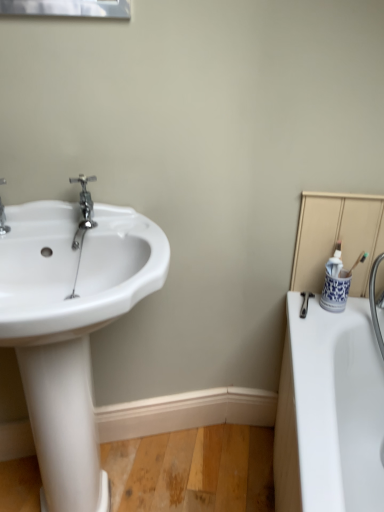
Question: Can blue and white ceramic cup at right be found inside white glossy sink at left?

Choices:
 (A) no
 (B) yes

Answer: (A)

Question: Is white glossy sink at left wider than blue and white ceramic cup at right?

Choices:
 (A) yes
 (B) no

Answer: (A)

Question: Is white glossy sink at left looking in the opposite direction of blue and white ceramic cup at right?

Choices:
 (A) yes
 (B) no

Answer: (B)

Question: From the image's perspective, is white glossy sink at left on top of blue and white ceramic cup at right?

Choices:
 (A) no
 (B) yes

Answer: (A)

Question: Does white glossy sink at left have a lesser width compared to blue and white ceramic cup at right?

Choices:
 (A) no
 (B) yes

Answer: (A)

Question: Considering the relative sizes of white glossy sink at left and blue and white ceramic cup at right in the image provided, is white glossy sink at left taller than blue and white ceramic cup at right?

Choices:
 (A) yes
 (B) no

Answer: (A)

Question: Is polished chrome faucet at left to the left of blue and white ceramic cup at right from the viewer's perspective?

Choices:
 (A) no
 (B) yes

Answer: (B)

Question: From the image's perspective, is polished chrome faucet at left located above blue and white ceramic cup at right?

Choices:
 (A) no
 (B) yes

Answer: (B)

Question: Does polished chrome faucet at left lie in front of blue and white ceramic cup at right?

Choices:
 (A) yes
 (B) no

Answer: (A)

Question: Is blue and white ceramic cup at right surrounded by polished chrome faucet at left?

Choices:
 (A) no
 (B) yes

Answer: (A)

Question: Is blue and white ceramic cup at right at the back of polished chrome faucet at left?

Choices:
 (A) no
 (B) yes

Answer: (A)

Question: Is polished chrome faucet at left facing towards blue and white ceramic cup at right?

Choices:
 (A) no
 (B) yes

Answer: (A)

Question: From the image's perspective, is blue and white ceramic cup at right under white glossy sink at left?

Choices:
 (A) no
 (B) yes

Answer: (A)